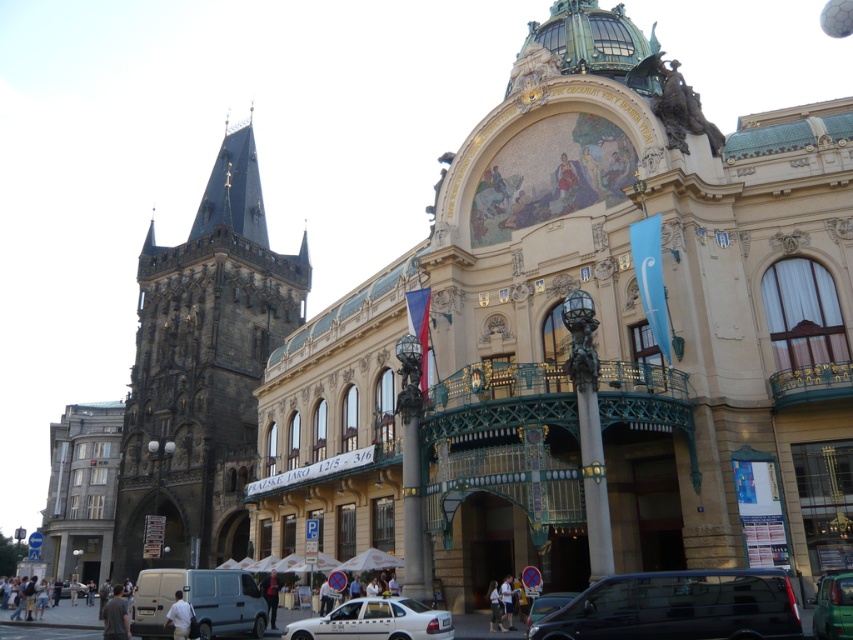
How much distance is there between dark brown stone tower at left and light blue shirt at center?

They are 78.76 meters apart.

Is dark brown stone tower at left wider than light blue shirt at center?

Yes.

The image size is (853, 640). What are the coordinates of `dark brown stone tower at left` in the screenshot? It's located at (202, 369).

Between shiny black van at lower center and metallic silver taxi at lower center, which one has less height?

shiny black van at lower center is shorter.

Which is more to the right, shiny black van at lower center or metallic silver taxi at lower center?

Positioned to the right is shiny black van at lower center.

Where is `shiny black van at lower center`? The height and width of the screenshot is (640, 853). shiny black van at lower center is located at coordinates (677, 608).

Where is `shiny black van at lower center`? This screenshot has height=640, width=853. shiny black van at lower center is located at coordinates (677, 608).

Between point (271, 598) and point (492, 600), which one is positioned behind?

The point (271, 598) is behind.

In order to click on dark blue jeans at lower center in this screenshot , I will do `click(270, 595)`.